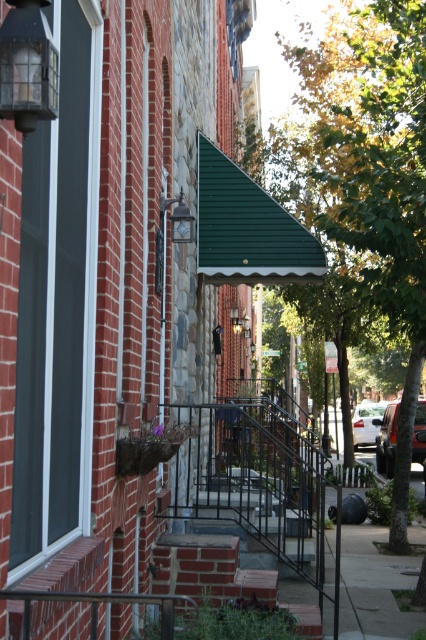
Is green leafy tree at center smaller than brick stairs at center?

No, green leafy tree at center is not smaller than brick stairs at center.

Is point (411, 232) more distant than point (238, 584)?

Yes, point (411, 232) is behind point (238, 584).

The image size is (426, 640). Identify the location of green leafy tree at center. (371, 172).

Can you confirm if green leafy tree at center is taller than clear glass lantern at upper left?

Indeed, green leafy tree at center has a greater height compared to clear glass lantern at upper left.

Who is more distant from viewer, (285, 145) or (48, 26)?

The point (285, 145) is more distant.

Locate an element on the screen. The image size is (426, 640). green leafy tree at center is located at coordinates (371, 172).

Between green leafy tree at center and green corrugated awning at center, which one has less height?

green corrugated awning at center is shorter.

Does green leafy tree at center appear on the left side of green corrugated awning at center?

In fact, green leafy tree at center is to the right of green corrugated awning at center.

Is point (370, 108) positioned before point (207, 150)?

Yes, point (370, 108) is closer to viewer.

At what (x,y) coordinates should I click in order to perform the action: click on green leafy tree at center. Please return your answer as a coordinate pair (x, y). Looking at the image, I should click on (371, 172).